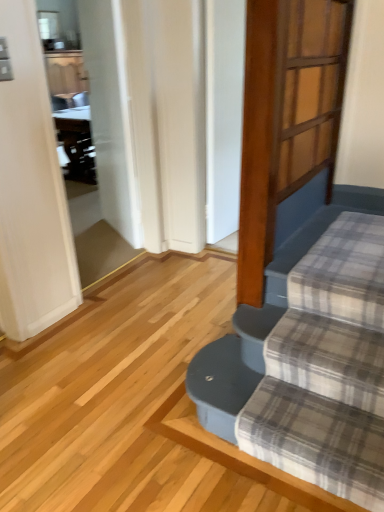
Question: Should I look upward or downward to see white glossy screen door at upper left, the 2th screen door in the front-to-back sequence?

Choices:
 (A) up
 (B) down

Answer: (A)

Question: From the image's perspective, is plaid fabric at lower right located beneath wooden screen door at upper right, acting as the 2th screen door starting from the left?

Choices:
 (A) yes
 (B) no

Answer: (A)

Question: Can you confirm if plaid fabric at lower right is smaller than wooden screen door at upper right, the first screen door positioned from the front?

Choices:
 (A) yes
 (B) no

Answer: (B)

Question: Is the depth of plaid fabric at lower right greater than that of wooden screen door at upper right, the 1th screen door when ordered from right to left?

Choices:
 (A) yes
 (B) no

Answer: (B)

Question: Considering the relative sizes of plaid fabric at lower right and wooden screen door at upper right, which is counted as the 2th screen door, starting from the back, in the image provided, is plaid fabric at lower right shorter than wooden screen door at upper right, which is counted as the 2th screen door, starting from the back,?

Choices:
 (A) yes
 (B) no

Answer: (A)

Question: From the image's perspective, would you say plaid fabric at lower right is positioned over wooden screen door at upper right, the 1th screen door when ordered from right to left?

Choices:
 (A) yes
 (B) no

Answer: (B)

Question: From a real-world perspective, is plaid fabric at lower right beneath wooden screen door at upper right, acting as the 2th screen door starting from the left?

Choices:
 (A) no
 (B) yes

Answer: (B)

Question: Does plaid fabric at lower right have a larger size compared to white glossy screen door at upper left, the 2th screen door in the right-to-left sequence?

Choices:
 (A) yes
 (B) no

Answer: (B)

Question: Can you confirm if plaid fabric at lower right is wider than white glossy screen door at upper left, which is the first screen door from back to front?

Choices:
 (A) no
 (B) yes

Answer: (B)

Question: From a real-world perspective, is plaid fabric at lower right located higher than white glossy screen door at upper left, the 2th screen door in the front-to-back sequence?

Choices:
 (A) yes
 (B) no

Answer: (B)

Question: Can you confirm if plaid fabric at lower right is thinner than white glossy screen door at upper left, which is the first screen door from back to front?

Choices:
 (A) no
 (B) yes

Answer: (A)

Question: Is plaid fabric at lower right directly adjacent to white glossy screen door at upper left, placed as the 1th screen door when sorted from left to right?

Choices:
 (A) yes
 (B) no

Answer: (B)

Question: From the image's perspective, is plaid fabric at lower right under white glossy screen door at upper left, the 2th screen door in the right-to-left sequence?

Choices:
 (A) no
 (B) yes

Answer: (B)

Question: Does white glossy screen door at upper left, placed as the 1th screen door when sorted from left to right, come behind wooden screen door at upper right, which is counted as the 2th screen door, starting from the back?

Choices:
 (A) no
 (B) yes

Answer: (B)